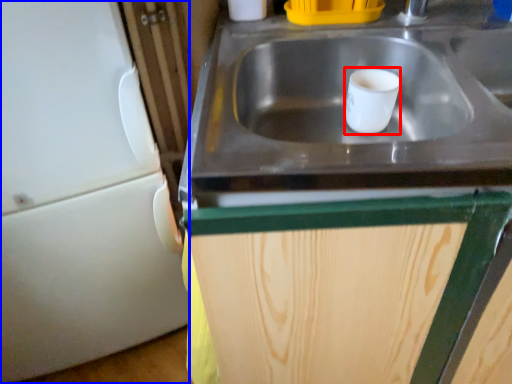
Question: Among these objects, which one is farthest to the camera, mug (highlighted by a red box) or appliance (highlighted by a blue box)?

Choices:
 (A) mug
 (B) appliance

Answer: (A)